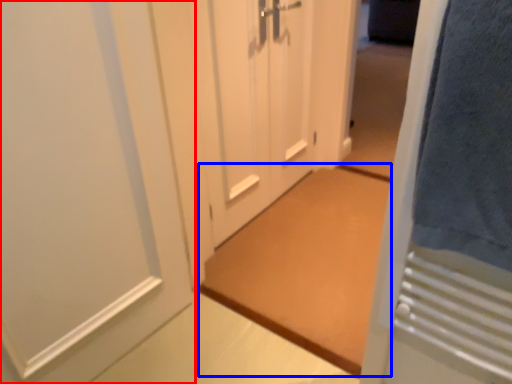
Question: Which object appears farthest to the camera in this image, door (highlighted by a red box) or doormat (highlighted by a blue box)?

Choices:
 (A) door
 (B) doormat

Answer: (B)